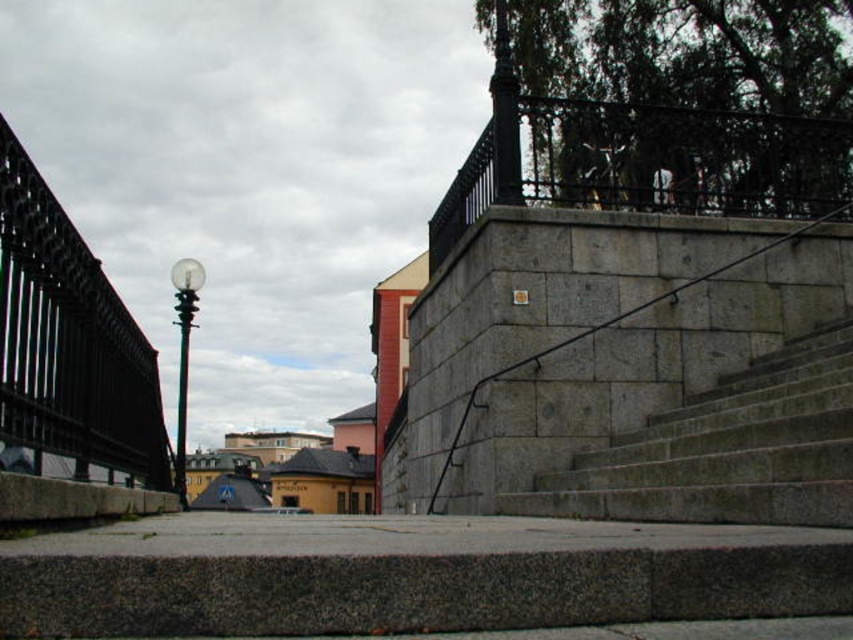
You are a delivery person carrying a heavy box and need to walk up the gray stone stairs at center. There is a gray concrete at lower center nearby. Which surface has a wider path for you to walk on?

The gray concrete at lower center has a wider path than the gray stone stairs at center, so you should walk on the gray concrete at lower center.

Consider the image. You are standing at the base of the stone steps looking up towards the platform. There are two points marked on the steps. The first is at coordinate point (589, 324) and the second at point (761, 420). Which point is closer to you as you face the steps?

Point (589, 324) is closer to you because it is further to the viewer than point (761, 420).